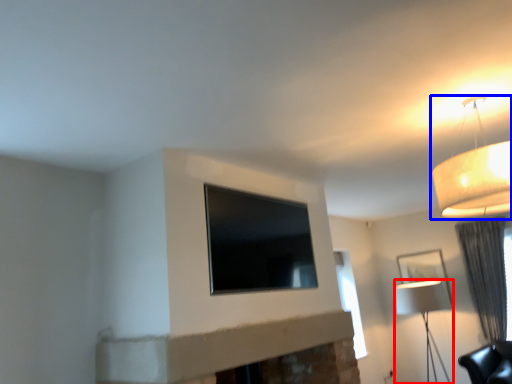
Question: Which object appears farthest to the camera in this image, lamp (highlighted by a red box) or lamp (highlighted by a blue box)?

Choices:
 (A) lamp
 (B) lamp

Answer: (A)